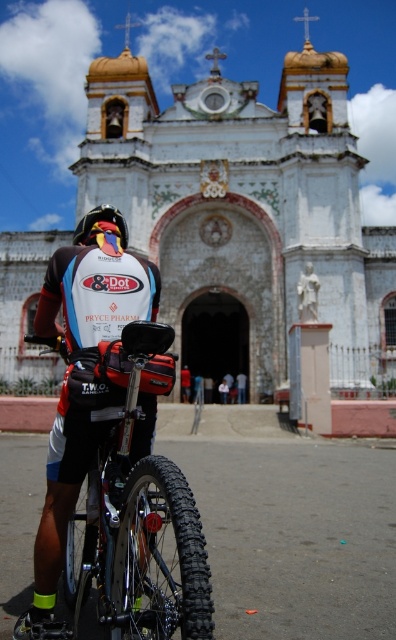
Does shiny black frame at center appear under dark blue fabric shirt at center?

Correct, shiny black frame at center is located below dark blue fabric shirt at center.

Is shiny black frame at center to the left of dark blue fabric shirt at center from the viewer's perspective?

Indeed, shiny black frame at center is positioned on the left side of dark blue fabric shirt at center.

Where is `shiny black frame at center`? The height and width of the screenshot is (640, 396). shiny black frame at center is located at coordinates (138, 522).

I want to click on shiny black frame at center, so coord(138,522).

What do you see at coordinates (100, 220) in the screenshot?
I see `multicolored plastic helmet at center` at bounding box center [100, 220].

Is multicolored plastic helmet at center positioned behind red fabric shorts at center?

No, multicolored plastic helmet at center is in front of red fabric shorts at center.

Is point (102, 211) in front of point (184, 371)?

Yes, point (102, 211) is in front of point (184, 371).

This screenshot has width=396, height=640. Find the location of `multicolored plastic helmet at center`. multicolored plastic helmet at center is located at coordinates (100, 220).

Is black rubber tire at lower center positioned behind dark blue fabric shirt at center?

No, black rubber tire at lower center is closer to the viewer.

Can you confirm if black rubber tire at lower center is smaller than dark blue fabric shirt at center?

No.

This screenshot has width=396, height=640. What are the coordinates of `black rubber tire at lower center` in the screenshot? It's located at point(295,536).

The image size is (396, 640). Identify the location of black rubber tire at lower center. (295, 536).